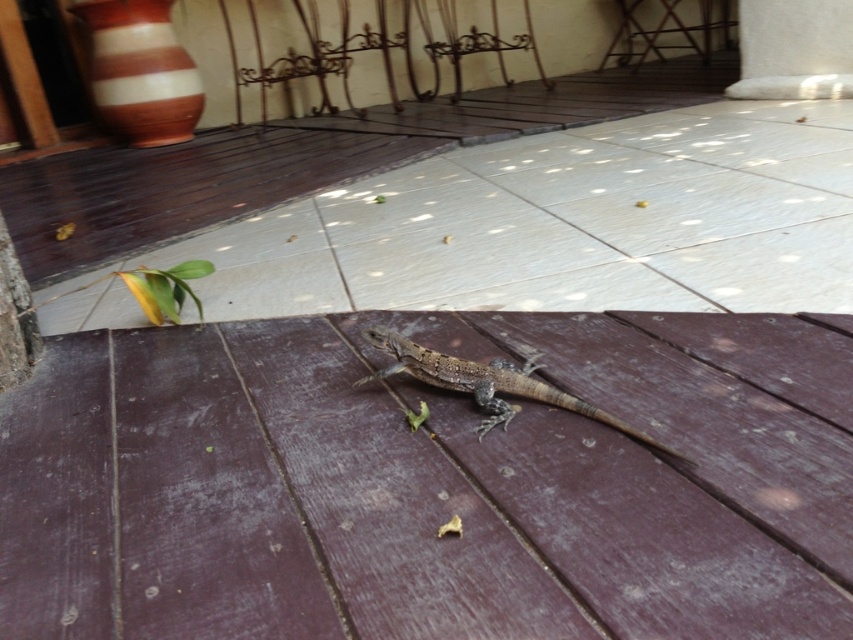
You are a small toy car that is 15 cm long. You are on the brown wooden deck at center and want to move towards the brown scaly lizard at center. Can you fit between them without touching either?

The brown wooden deck at center is larger than the brown scaly lizard at center, so yes, the toy car can fit between them without touching either.

You are standing on the brown wooden deck at center and want to reach the brown scaly lizard at center. Which direction should you move to get closer to the lizard?

The brown wooden deck at center is closer to the viewer than the brown scaly lizard at center, so you should move forward away from the deck towards the lizard to get closer.